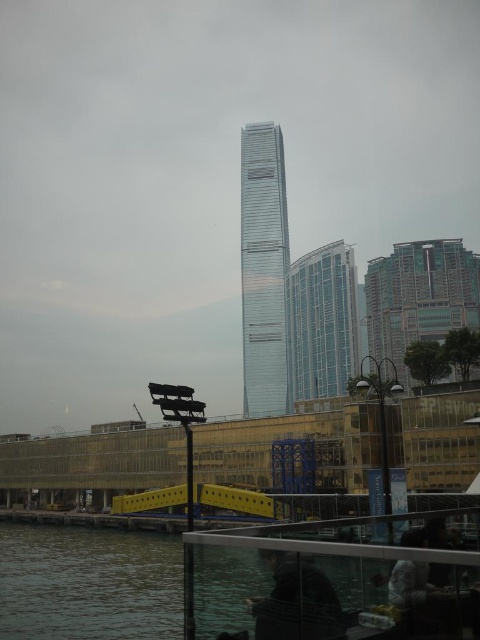
Which of these two, clear glass building at center or dark gray fabric jacket at lower center, stands shorter?

Standing shorter between the two is dark gray fabric jacket at lower center.

Does point (302, 316) come behind point (339, 616)?

Yes.

Identify the location of clear glass building at center. Image resolution: width=480 pixels, height=640 pixels. (321, 323).

Is point (427, 310) positioned after point (315, 570)?

Yes, point (427, 310) is farther from viewer.

Does metallic glass building at right appear over dark gray fabric jacket at lower center?

Yes.

Is point (400, 380) more distant than point (268, 618)?

Yes.

At what (x,y) coordinates should I click in order to perform the action: click on metallic glass building at right. Please return your answer as a coordinate pair (x, y). Looking at the image, I should click on (420, 296).

Is transparent glass skyscraper at center above clear glass building at center?

Actually, transparent glass skyscraper at center is below clear glass building at center.

Where is `transparent glass skyscraper at center`? This screenshot has width=480, height=640. transparent glass skyscraper at center is located at coordinates click(x=264, y=269).